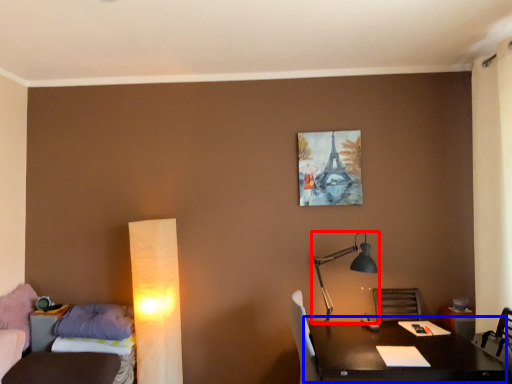
Question: Which object is further to the camera taking this photo, lamp (highlighted by a red box) or table (highlighted by a blue box)?

Choices:
 (A) lamp
 (B) table

Answer: (A)